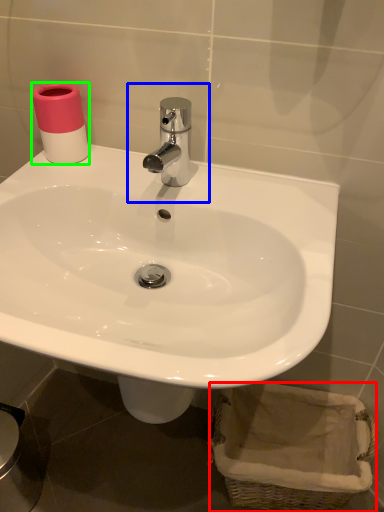
Question: Which object is positioned closest to basket (highlighted by a red box)? Select from plumbing fixture (highlighted by a blue box) and toilet paper (highlighted by a green box).

Choices:
 (A) plumbing fixture
 (B) toilet paper

Answer: (A)